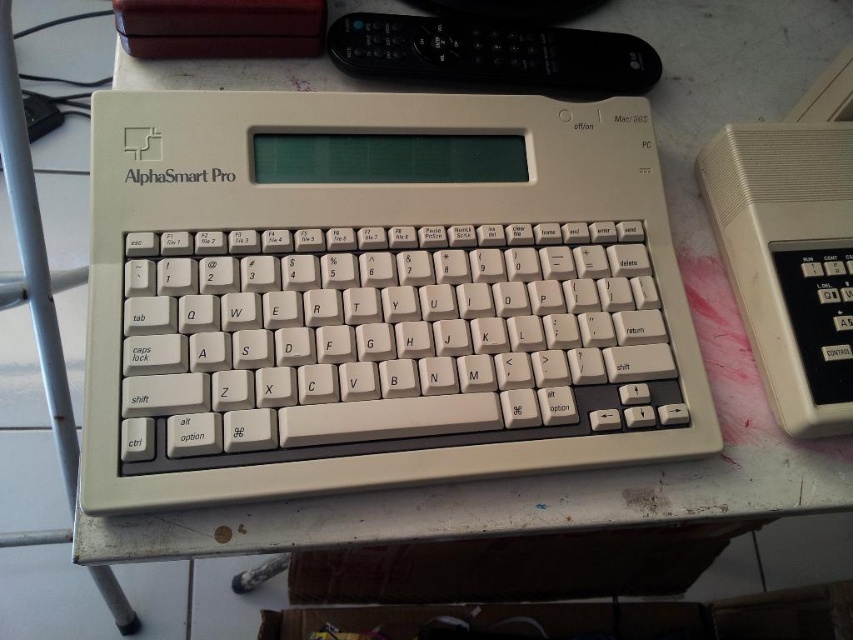
Question: Which point is closer to the camera taking this photo?

Choices:
 (A) (392, 16)
 (B) (799, 212)

Answer: (B)

Question: Does beige plastic calculator at right appear under black plastic remote at upper center?

Choices:
 (A) yes
 (B) no

Answer: (A)

Question: Does beige plastic calculator at right have a larger size compared to black plastic remote at upper center?

Choices:
 (A) yes
 (B) no

Answer: (A)

Question: Which object is farther from the camera taking this photo?

Choices:
 (A) beige plastic calculator at right
 (B) black plastic remote at upper center

Answer: (B)

Question: Does beige plastic calculator at right have a smaller size compared to black plastic remote at upper center?

Choices:
 (A) yes
 (B) no

Answer: (B)

Question: Which object is closer to the camera taking this photo?

Choices:
 (A) black plastic remote at upper center
 (B) beige plastic calculator at right

Answer: (B)